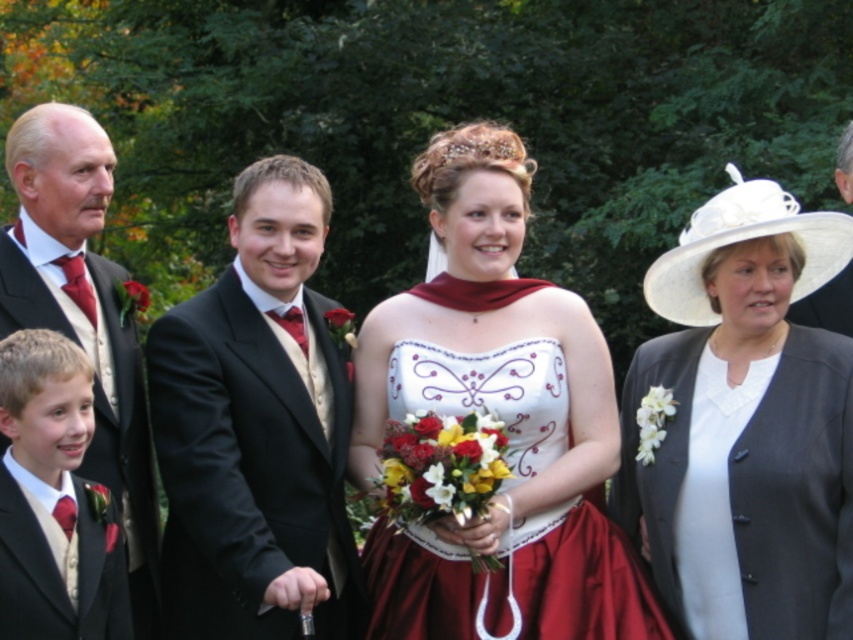
Which of these two, matte black suit at left or matte black suit at right, stands shorter?

Standing shorter between the two is matte black suit at right.

Is point (71, 205) positioned behind point (850, 198)?

No, it is in front of (850, 198).

Locate an element on the screen. The width and height of the screenshot is (853, 640). matte black suit at left is located at coordinates (83, 312).

Is white felt hat at upper right smaller than white satin dress at center?

Actually, white felt hat at upper right might be larger than white satin dress at center.

Who is shorter, white felt hat at upper right or white satin dress at center?

white satin dress at center is shorter.

You are a GUI agent. You are given a task and a screenshot of the screen. Output one action in this format:
    pyautogui.click(x=<x>, y=<y>)
    Task: Click on the white felt hat at upper right
    This screenshot has height=640, width=853.
    Given the screenshot: What is the action you would take?
    pyautogui.click(x=746, y=424)

Does matte black suit at left lie in front of matte black suit at lower left?

That is False.

Who is positioned more to the left, matte black suit at left or matte black suit at lower left?

matte black suit at left

Where is `matte black suit at left`? matte black suit at left is located at coordinates (83, 312).